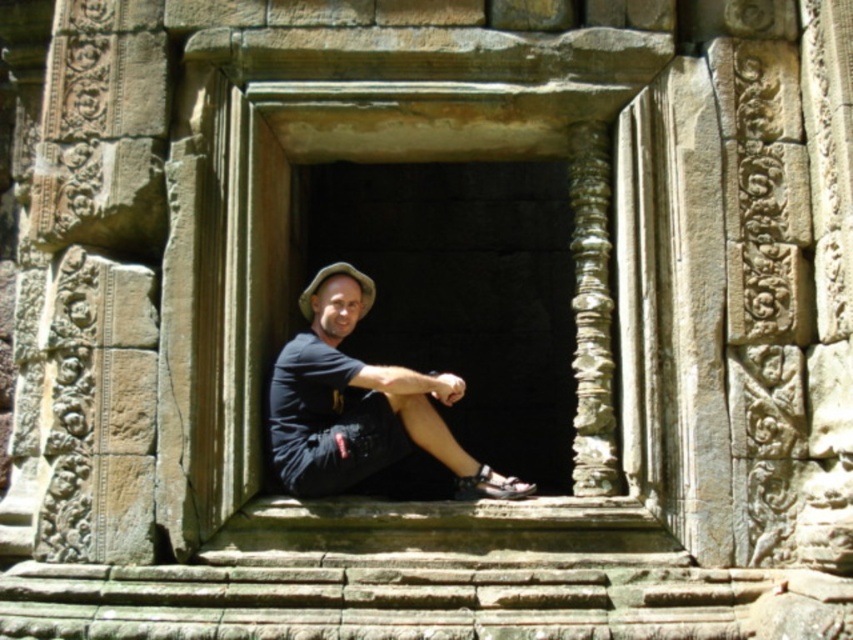
Question: Which point appears closest to the camera in this image?

Choices:
 (A) (178, 156)
 (B) (329, 474)

Answer: (B)

Question: Can you confirm if stone textured window at center is positioned to the left of black matte shirt at center?

Choices:
 (A) yes
 (B) no

Answer: (A)

Question: Does stone textured window at center appear under black matte shirt at center?

Choices:
 (A) yes
 (B) no

Answer: (B)

Question: Does stone textured window at center appear on the left side of black matte shirt at center?

Choices:
 (A) yes
 (B) no

Answer: (A)